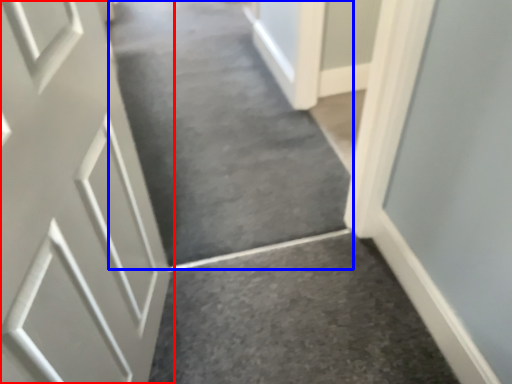
Question: Which of the following is the farthest to the observer, door (highlighted by a red box) or aisle (highlighted by a blue box)?

Choices:
 (A) door
 (B) aisle

Answer: (B)